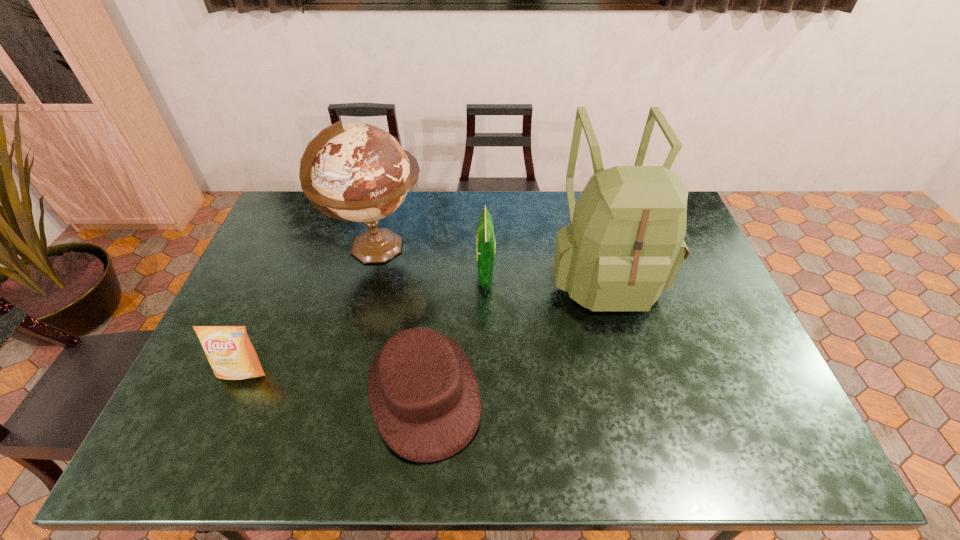
At what (x,y) coordinates should I click in order to perform the action: click on free point that satisfies the following two spatial constraints: 1. on the front pocket of the backpack; 2. on the front-facing side of the taller crisp (potato chip). Please return your answer as a coordinate pair (x, y). Image resolution: width=960 pixels, height=540 pixels. Looking at the image, I should click on (604, 275).

You are a GUI agent. You are given a task and a screenshot of the screen. Output one action in this format:
    pyautogui.click(x=<x>, y=<y>)
    Task: Click on the free space that satisfies the following two spatial constraints: 1. on the front-facing side of the farther crisp (potato chip); 2. on the front-facing side of the second shortest object
    The width and height of the screenshot is (960, 540).
    Given the screenshot: What is the action you would take?
    pyautogui.click(x=487, y=372)

Identify the location of vacant space that satisfies the following two spatial constraints: 1. on the front of the shortest object showing Asia; 2. on the right side of the globe. The width and height of the screenshot is (960, 540). (343, 393).